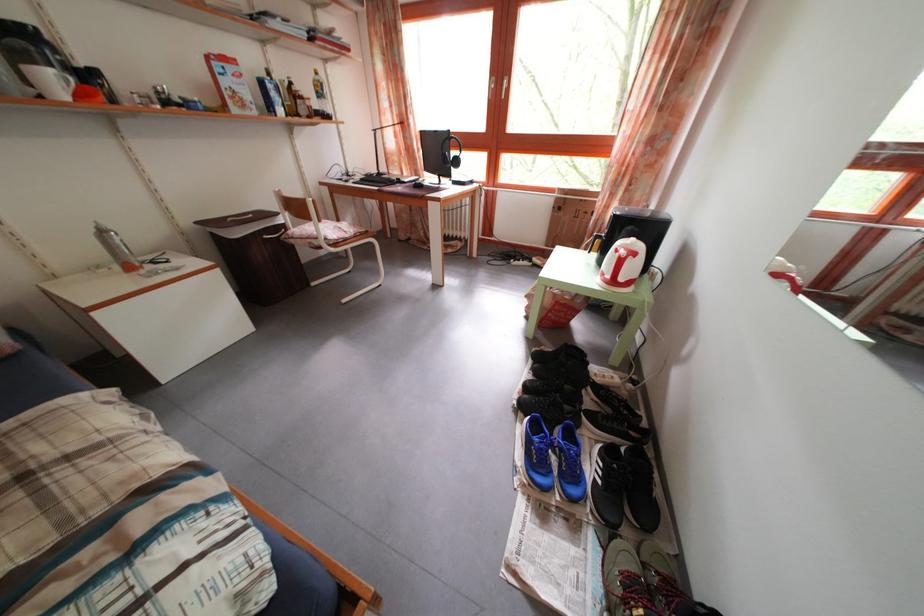
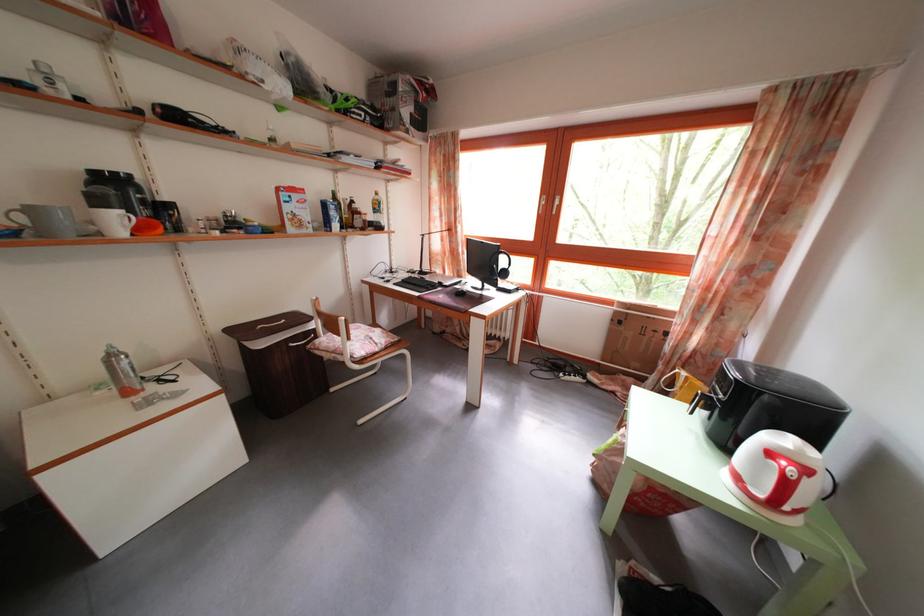
Find the pixel in the second image that matches point (290, 233) in the first image.

(322, 339)